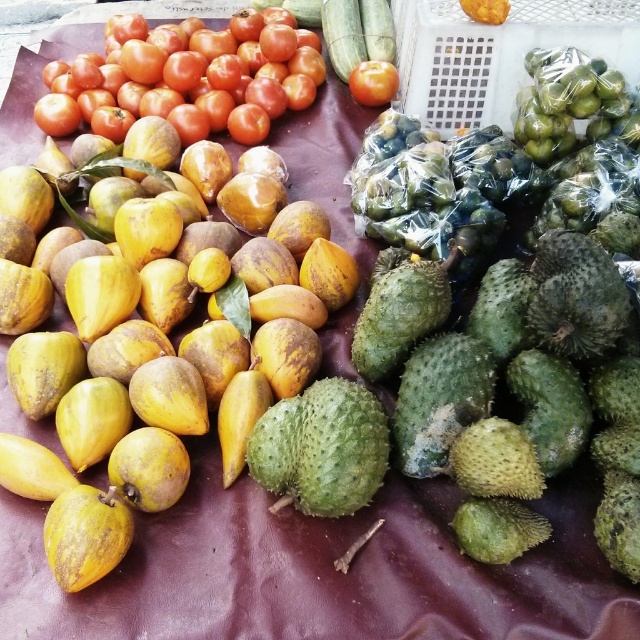
Which is behind, point (324, 272) or point (108, 90)?

Positioned behind is point (108, 90).

Which is in front, point (300, 372) or point (301, 90)?

Positioned in front is point (300, 372).

The height and width of the screenshot is (640, 640). Identify the location of yellow matte fruit at left. (156, 362).

Which is behind, point (269, 99) or point (378, 81)?

Positioned behind is point (269, 99).

Does shiny red tomatoes at upper left have a greater width compared to shiny red tomato at upper center?

Yes.

Is point (92, 77) positioned before point (381, 92)?

Yes, point (92, 77) is in front of point (381, 92).

What are the coordinates of `shiny red tomatoes at upper left` in the screenshot? It's located at (184, 72).

Is yellow matte fruit at left behind shiny red tomato at upper center?

No, it is in front of shiny red tomato at upper center.

Between yellow matte fruit at left and shiny red tomato at upper center, which one is positioned lower?

yellow matte fruit at left is lower down.

Between point (138, 241) and point (364, 97), which one is positioned behind?

The point (364, 97) is more distant.

I want to click on yellow matte fruit at left, so click(156, 362).